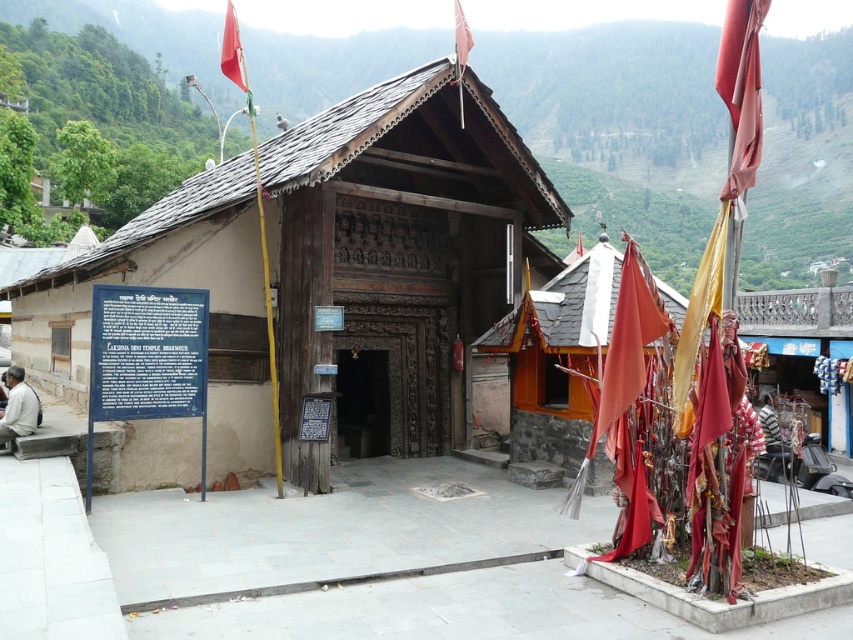
Can you confirm if wooden shrine at center is positioned below light beige stone man at lower left?

Yes, wooden shrine at center is below light beige stone man at lower left.

Identify the location of wooden shrine at center. Image resolution: width=853 pixels, height=640 pixels. (556, 362).

Is point (531, 406) farther from camera compared to point (33, 413)?

Yes.

Locate an element on the screen. This screenshot has height=640, width=853. wooden shrine at center is located at coordinates (556, 362).

Is wooden carved door at center in front of red fabric flag at upper right?

No, wooden carved door at center is behind red fabric flag at upper right.

Which is behind, point (521, 252) or point (744, 141)?

Positioned behind is point (521, 252).

Locate an element on the screen. wooden carved door at center is located at coordinates (399, 250).

What do you see at coordinates (399, 250) in the screenshot? Image resolution: width=853 pixels, height=640 pixels. I see `wooden carved door at center` at bounding box center [399, 250].

Is wooden carved door at center taller than wooden shrine at center?

Yes.

Locate an element on the screen. This screenshot has width=853, height=640. wooden carved door at center is located at coordinates (399, 250).

At what (x,y) coordinates should I click in order to perform the action: click on wooden carved door at center. Please return your answer as a coordinate pair (x, y). This screenshot has width=853, height=640. Looking at the image, I should click on (399, 250).